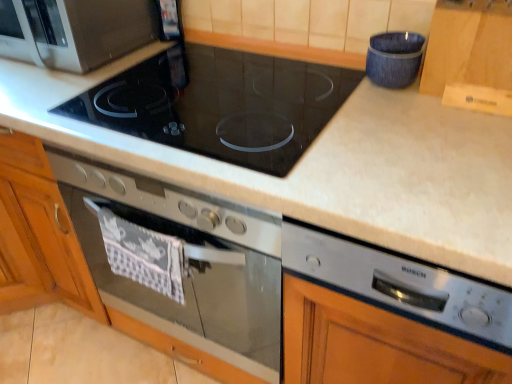
Question: Considering the positions of point (78, 107) and point (374, 44), is point (78, 107) closer or farther from the camera than point (374, 44)?

Choices:
 (A) farther
 (B) closer

Answer: (A)

Question: Is black glass cooktop at center to the left or to the right of blue textured fabric at upper right, which is counted as the second appliance, starting from the front, in the image?

Choices:
 (A) left
 (B) right

Answer: (A)

Question: Based on their relative distances, which object is farther from the satin silver dishwasher at lower right, marked as the 2th appliance in a back-to-front arrangement?

Choices:
 (A) blue textured fabric at upper right, which is counted as the second appliance, starting from the front
 (B) satin silver oven at center
 (C) matte black microwave at upper left
 (D) black glass cooktop at center

Answer: (C)

Question: Estimate the real-world distances between objects in this image. Which object is farther from the matte black microwave at upper left?

Choices:
 (A) satin silver dishwasher at lower right, arranged as the 1th appliance when viewed from the front
 (B) satin silver oven at center
 (C) black glass cooktop at center
 (D) blue textured fabric at upper right, which is counted as the second appliance, starting from the front

Answer: (A)